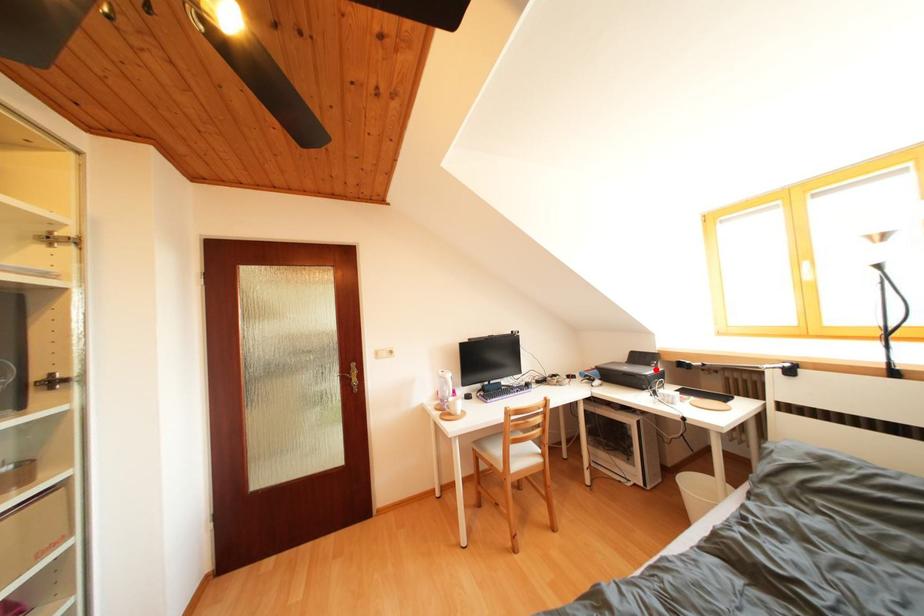
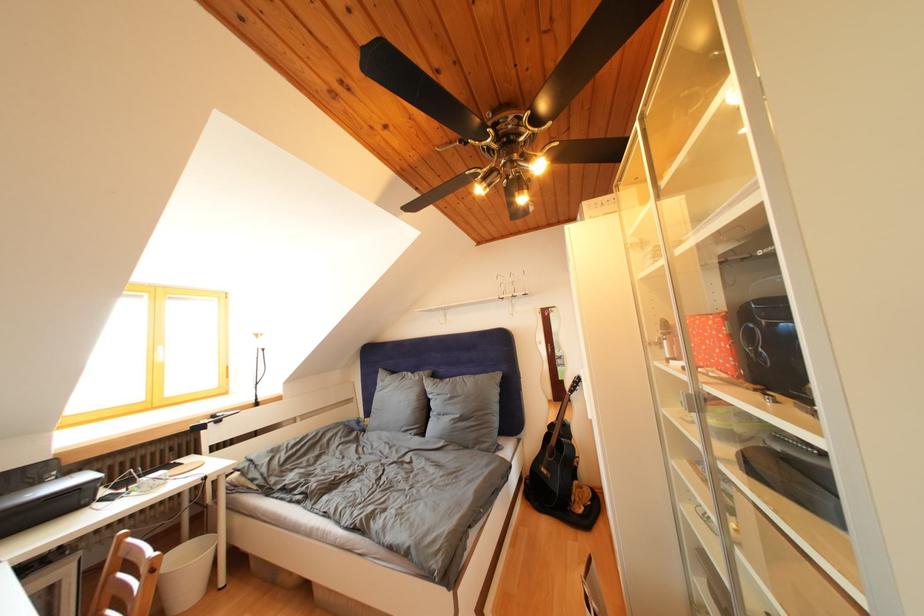
Question: I am providing you with two images of the same scene from different viewpoints. In image1, a red point is highlighted. Considering the same 3D point in image2, which of the following is correct?

Choices:
 (A) It is closer
 (B) It is farther

Answer: (A)